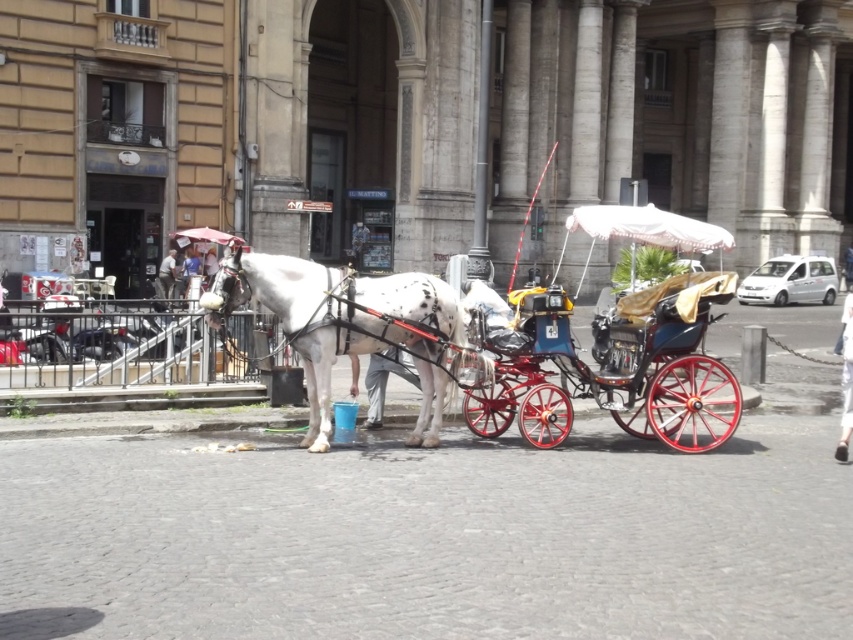
Question: Is white speckled fur at center to the left of white leather coach at center from the viewer's perspective?

Choices:
 (A) yes
 (B) no

Answer: (B)

Question: Which of the following is the farthest from the observer?

Choices:
 (A) white speckled fur at center
 (B) white leather coach at center
 (C) polished wood cart at center

Answer: (B)

Question: Estimate the real-world distances between objects in this image. Which object is farther from the white leather coach at center?

Choices:
 (A) polished wood cart at center
 (B) white speckled fur at center

Answer: (B)

Question: Which of the following is the closest to the observer?

Choices:
 (A) (573, 372)
 (B) (172, 278)
 (C) (325, 356)

Answer: (C)

Question: In this image, where is polished wood cart at center located relative to white speckled fur at center?

Choices:
 (A) below
 (B) above

Answer: (A)

Question: Can you confirm if polished wood cart at center is bigger than white leather coach at center?

Choices:
 (A) yes
 (B) no

Answer: (B)